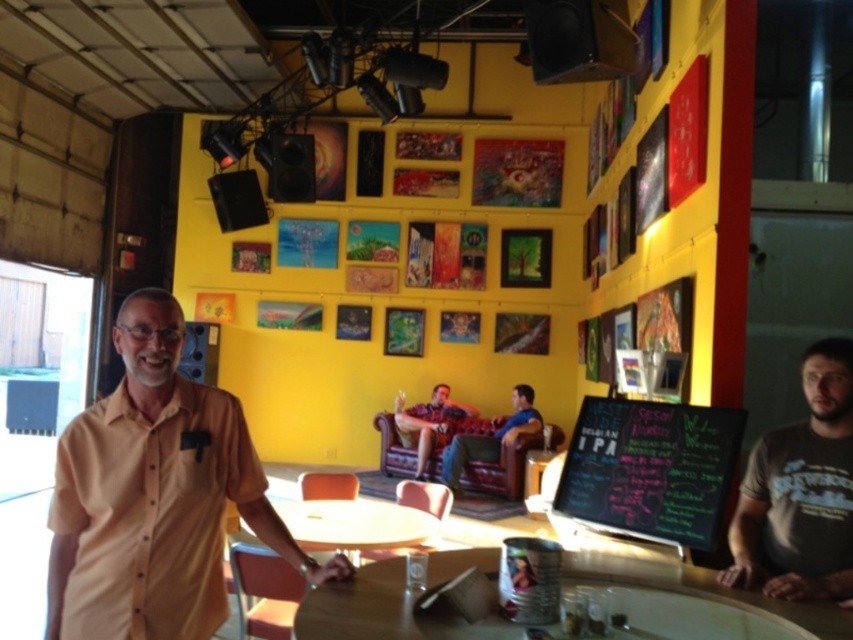
Question: Can you confirm if wooden round table at center is bigger than yellow matte table at center?

Choices:
 (A) yes
 (B) no

Answer: (B)

Question: Considering the relative positions of dark brown t-shirt at center and wooden round table at center in the image provided, where is dark brown t-shirt at center located with respect to wooden round table at center?

Choices:
 (A) right
 (B) left

Answer: (A)

Question: Estimate the real-world distances between objects in this image. Which object is closer to the patterned fabric shirt at center?

Choices:
 (A) yellow matte table at center
 (B) wooden round table at center
 (C) matte yellow shirt at center
 (D) chalkboard at center

Answer: (A)

Question: Does dark brown t-shirt at center lie behind chalkboard at center?

Choices:
 (A) yes
 (B) no

Answer: (B)

Question: Which point is farther to the camera?

Choices:
 (A) matte yellow shirt at center
 (B) chalkboard at center

Answer: (B)

Question: Which point is farther to the camera?

Choices:
 (A) dark brown t-shirt at center
 (B) wooden round table at center
 (C) blue denim jeans at center
 (D) matte yellow shirt at center

Answer: (C)